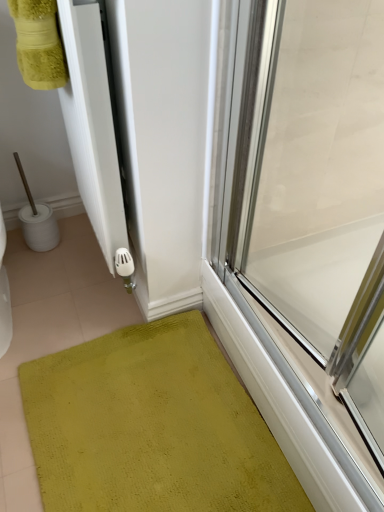
In order to face transparent glass door at right, should I rotate leftwards or rightwards?

Turn right approximately 13.439 degrees to face it.

In order to click on transparent glass door at right in this screenshot , I will do `click(307, 200)`.

This screenshot has height=512, width=384. What do you see at coordinates (307, 200) in the screenshot?
I see `transparent glass door at right` at bounding box center [307, 200].

What do you see at coordinates (152, 426) in the screenshot?
I see `green textured bath mat at lower left` at bounding box center [152, 426].

Image resolution: width=384 pixels, height=512 pixels. What are the coordinates of `green textured bath mat at lower left` in the screenshot? It's located at (152, 426).

Image resolution: width=384 pixels, height=512 pixels. What are the coordinates of `transparent glass door at right` in the screenshot? It's located at (307, 200).

Is green textured bath mat at lower left to the right of transparent glass door at right from the viewer's perspective?

No.

Does green textured bath mat at lower left come in front of transparent glass door at right?

No, green textured bath mat at lower left is further to the viewer.

Considering the points (36, 439) and (247, 112), which point is in front, point (36, 439) or point (247, 112)?

The point (247, 112) is closer.

From the image's perspective, which one is positioned lower, green textured bath mat at lower left or transparent glass door at right?

From the image's view, green textured bath mat at lower left is below.

From a real-world perspective, does green textured bath mat at lower left sit lower than transparent glass door at right?

Correct, in the physical world, green textured bath mat at lower left is lower than transparent glass door at right.

Can you confirm if green textured bath mat at lower left is wider than transparent glass door at right?

Yes, green textured bath mat at lower left is wider than transparent glass door at right.

Can you confirm if green textured bath mat at lower left is taller than transparent glass door at right?

No.

Is green textured bath mat at lower left bigger or smaller than transparent glass door at right?

Considering their sizes, green textured bath mat at lower left takes up less space than transparent glass door at right.

Consider the image. Is green textured bath mat at lower left located outside transparent glass door at right?

That's correct, green textured bath mat at lower left is outside of transparent glass door at right.

Is green textured bath mat at lower left placed right next to transparent glass door at right?

There is a gap between green textured bath mat at lower left and transparent glass door at right.

Is green textured bath mat at lower left facing towards transparent glass door at right?

No, green textured bath mat at lower left is not facing towards transparent glass door at right.

How many degrees apart are the facing directions of green textured bath mat at lower left and transparent glass door at right?

9.98 degrees.

You are a GUI agent. You are given a task and a screenshot of the screen. Output one action in this format:
    pyautogui.click(x=<x>, y=<y>)
    Task: Click on the bath mat below the transparent glass door at right (from the image's perspective)
    This screenshot has width=384, height=512.
    Given the screenshot: What is the action you would take?
    pyautogui.click(x=152, y=426)

Which object is positioned more to the right, transparent glass door at right or green textured bath mat at lower left?

From the viewer's perspective, transparent glass door at right appears more on the right side.

Which is in front, transparent glass door at right or green textured bath mat at lower left?

transparent glass door at right.

Considering the positions of point (310, 356) and point (149, 510), is point (310, 356) closer or farther from the camera than point (149, 510)?

Point (310, 356) appears to be farther away from the viewer than point (149, 510).

From the image's perspective, is transparent glass door at right on green textured bath mat at lower left?

Yes, from the image's perspective, transparent glass door at right is over green textured bath mat at lower left.

From a real-world perspective, is transparent glass door at right physically above green textured bath mat at lower left?

Yes, from a real-world perspective, transparent glass door at right is on top of green textured bath mat at lower left.

Considering the sizes of objects transparent glass door at right and green textured bath mat at lower left in the image provided, who is thinner, transparent glass door at right or green textured bath mat at lower left?

transparent glass door at right.

Considering the relative sizes of transparent glass door at right and green textured bath mat at lower left in the image provided, is transparent glass door at right shorter than green textured bath mat at lower left?

No, transparent glass door at right is not shorter than green textured bath mat at lower left.

Between transparent glass door at right and green textured bath mat at lower left, which one has larger size?

transparent glass door at right.

Can we say transparent glass door at right lies outside green textured bath mat at lower left?

Yes, transparent glass door at right is not within green textured bath mat at lower left.

Would you say transparent glass door at right is a long distance from green textured bath mat at lower left?

No, there isn't a large distance between transparent glass door at right and green textured bath mat at lower left.

Is transparent glass door at right positioned with its back to green textured bath mat at lower left?

No, transparent glass door at right's orientation is not away from green textured bath mat at lower left.

What's the angular difference between transparent glass door at right and green textured bath mat at lower left's facing directions?

9.98 degrees separate the facing orientations of transparent glass door at right and green textured bath mat at lower left.

Where is `glass door above the green textured bath mat at lower left (from the image's perspective)`? glass door above the green textured bath mat at lower left (from the image's perspective) is located at coordinates (307, 200).

The image size is (384, 512). Identify the location of bath mat beneath the transparent glass door at right (from a real-world perspective). (152, 426).

Where is `glass door above the green textured bath mat at lower left (from a real-world perspective)`? glass door above the green textured bath mat at lower left (from a real-world perspective) is located at coordinates pos(307,200).